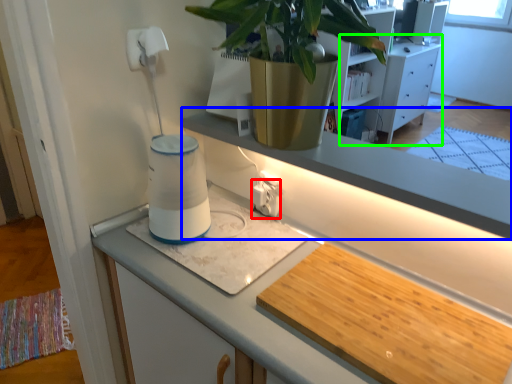
Question: Based on their relative distances, which object is nearer to electric outlet (highlighted by a red box)? Choose from window sill (highlighted by a blue box) and dresser (highlighted by a green box).

Choices:
 (A) window sill
 (B) dresser

Answer: (A)